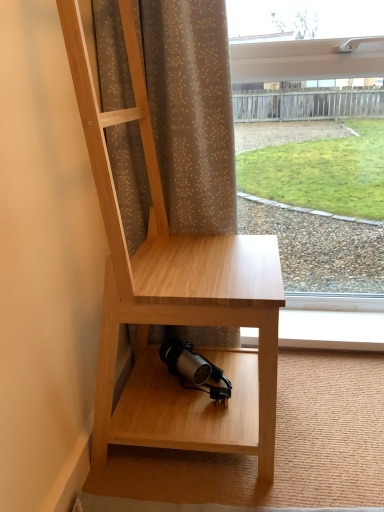
Question: Is transparent glass window at upper right surrounding natural wood desk at center?

Choices:
 (A) no
 (B) yes

Answer: (A)

Question: Does transparent glass window at upper right turn towards natural wood desk at center?

Choices:
 (A) yes
 (B) no

Answer: (A)

Question: Is transparent glass window at upper right not within natural wood desk at center?

Choices:
 (A) no
 (B) yes

Answer: (B)

Question: From a real-world perspective, does transparent glass window at upper right stand above natural wood desk at center?

Choices:
 (A) yes
 (B) no

Answer: (A)

Question: Does transparent glass window at upper right come behind natural wood desk at center?

Choices:
 (A) yes
 (B) no

Answer: (A)

Question: Looking at their shapes, would you say natural wood desk at center is wider or thinner than transparent glass window at upper right?

Choices:
 (A) wide
 (B) thin

Answer: (A)

Question: Considering the positions of point click(213, 269) and point click(281, 37), is point click(213, 269) closer or farther from the camera than point click(281, 37)?

Choices:
 (A) closer
 (B) farther

Answer: (A)

Question: Is natural wood desk at center inside or outside of transparent glass window at upper right?

Choices:
 (A) outside
 (B) inside

Answer: (A)

Question: From their relative heights in the image, would you say natural wood desk at center is taller or shorter than transparent glass window at upper right?

Choices:
 (A) tall
 (B) short

Answer: (B)

Question: From a real-world perspective, is brown sheer curtain at upper center physically located above or below natural wood desk at center?

Choices:
 (A) above
 (B) below

Answer: (A)

Question: From the image's perspective, is brown sheer curtain at upper center located above or below natural wood desk at center?

Choices:
 (A) above
 (B) below

Answer: (A)

Question: Which is correct: brown sheer curtain at upper center is inside natural wood desk at center, or outside of it?

Choices:
 (A) outside
 (B) inside

Answer: (A)

Question: Considering the positions of brown sheer curtain at upper center and natural wood desk at center in the image, is brown sheer curtain at upper center taller or shorter than natural wood desk at center?

Choices:
 (A) tall
 (B) short

Answer: (B)

Question: Based on their positions, is natural wood desk at center located to the left or right of brown sheer curtain at upper center?

Choices:
 (A) right
 (B) left

Answer: (A)

Question: In the image, is natural wood desk at center positioned in front of or behind brown sheer curtain at upper center?

Choices:
 (A) front
 (B) behind

Answer: (A)